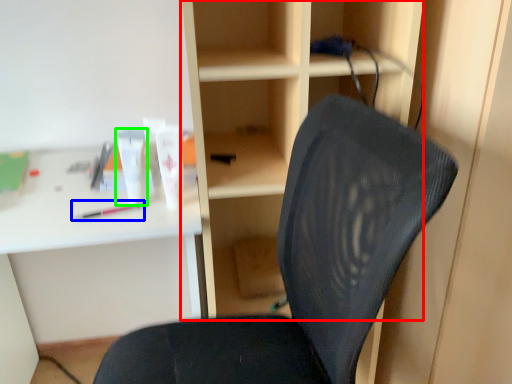
Question: Considering the real-world distances, which object is farthest from bookshelf (highlighted by a red box)? stationery (highlighted by a blue box) or toiletry (highlighted by a green box)?

Choices:
 (A) stationery
 (B) toiletry

Answer: (A)